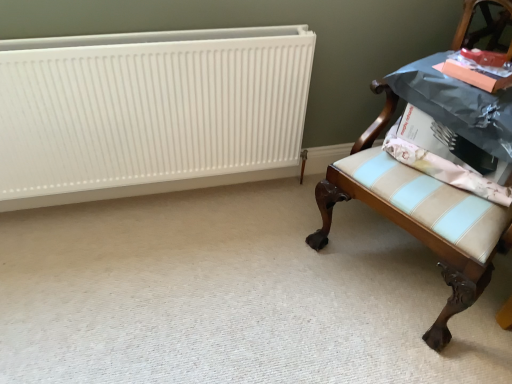
Locate an element on the screen. free spot in front of white matte radiator at upper left is located at coordinates (143, 281).